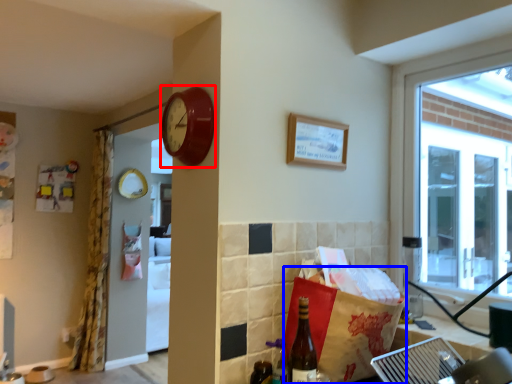
Question: Which point is closer to the camera, clock (highlighted by a red box) or shopping bag (highlighted by a blue box)?

Choices:
 (A) clock
 (B) shopping bag

Answer: (B)